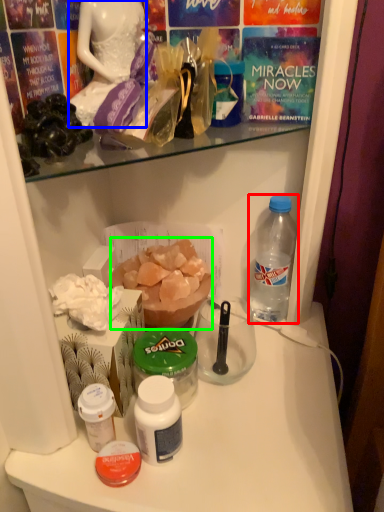
Question: Estimate the real-world distances between objects in this image. Which object is closer to bottle (highlighted by a red box), fancy dress (highlighted by a blue box) or food (highlighted by a green box)?

Choices:
 (A) fancy dress
 (B) food

Answer: (B)